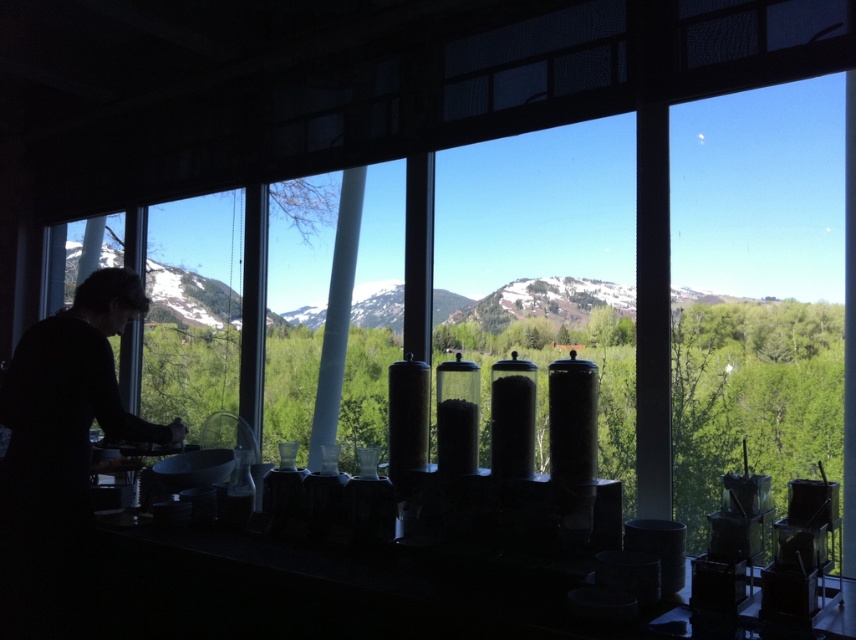
You are a chef preparing a meal and need to place a tall ingredient container on the counter. The container is 1.2 meters in height. Can the transparent glass containers at center and the transparent glass window at left accommodate this container in terms of height?

The transparent glass containers at center is taller than transparent glass window at left. Since the container is 1.2 meters tall, the transparent glass containers at center can accommodate it, but the transparent glass window at left may not have enough height.

You are a painter planning to set up an easel to paint the view outside. You have two options for placement near the transparent glass window at center or the transparent glass window at left. Which window should you choose to have a better view of the mountain peaks?

The transparent glass window at center is much taller than the transparent glass window at left, so choosing the transparent glass window at center would provide a better view of the mountain peaks due to its greater height allowing for a wider vertical perspective.

What are the coordinates of the transparent glass containers at center?

The transparent glass containers at center are located at coordinates point (536, 237).